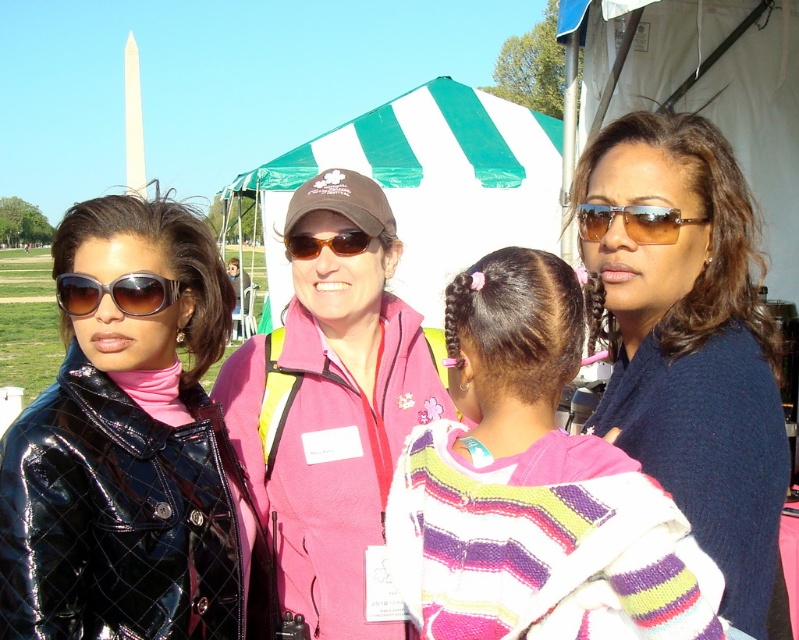
Can you confirm if matte blue sweater at center is thinner than matte black sunglasses at left?

No.

Can you confirm if matte blue sweater at center is smaller than matte black sunglasses at left?

No.

This screenshot has height=640, width=799. In order to click on matte blue sweater at center in this screenshot , I will do `click(690, 339)`.

You are a GUI agent. You are given a task and a screenshot of the screen. Output one action in this format:
    pyautogui.click(x=<x>, y=<y>)
    Task: Click on the matte blue sweater at center
    Image resolution: width=799 pixels, height=640 pixels.
    Given the screenshot: What is the action you would take?
    pyautogui.click(x=690, y=339)

Who is positioned more to the left, matte blue sweater at center or matte brown sunglasses at center?

matte brown sunglasses at center is more to the left.

From the picture: Is matte blue sweater at center shorter than matte brown sunglasses at center?

Incorrect, matte blue sweater at center's height does not fall short of matte brown sunglasses at center's.

The width and height of the screenshot is (799, 640). I want to click on matte blue sweater at center, so click(x=690, y=339).

Does matte black sunglasses at left have a lesser height compared to matte brown sunglasses at right?

Yes, matte black sunglasses at left is shorter than matte brown sunglasses at right.

Does point (66, 300) lie in front of point (654, 214)?

No, it is behind (654, 214).

Where is `matte black sunglasses at left`? The height and width of the screenshot is (640, 799). matte black sunglasses at left is located at coordinates (114, 292).